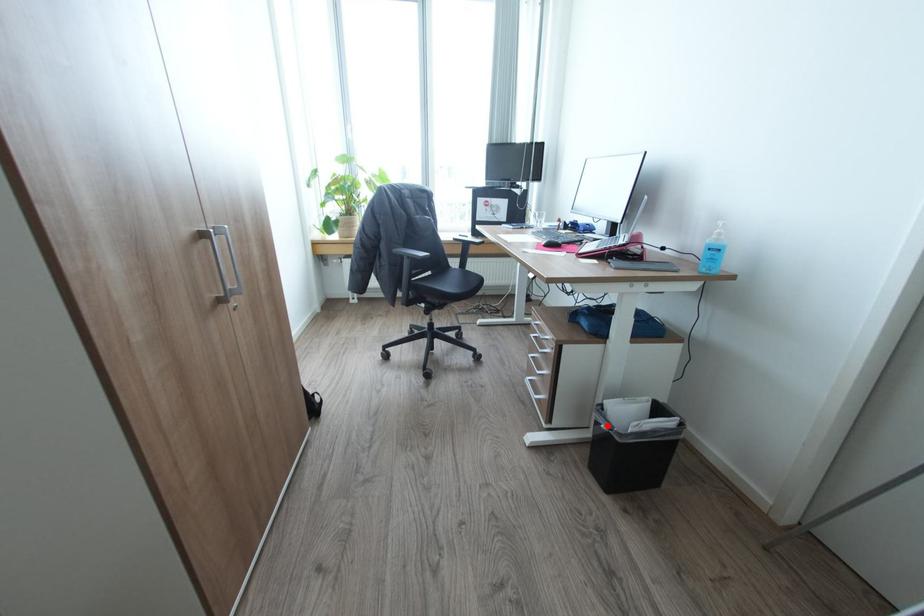
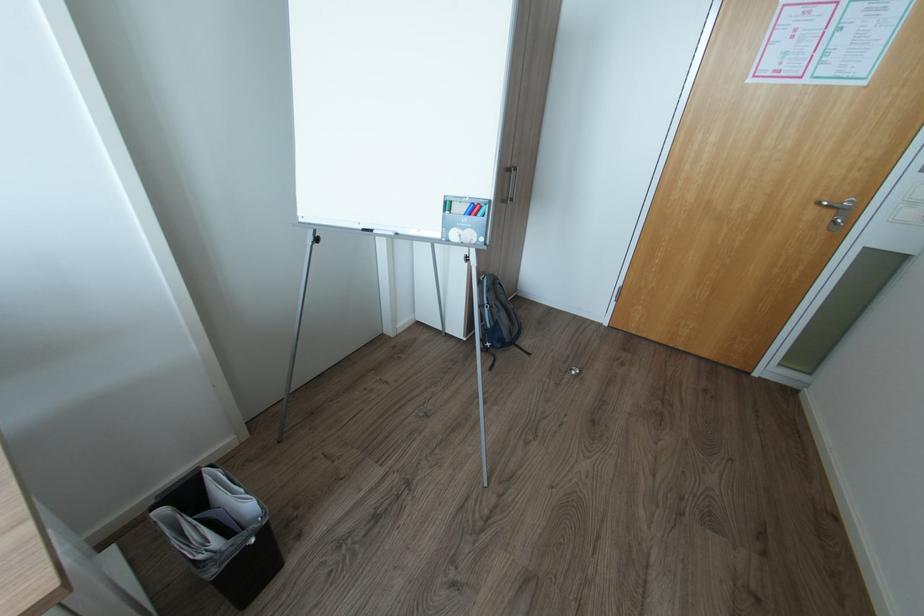
Question: I am providing you with two images of the same scene from different viewpoints. In image1, a red point is highlighted. Considering the same 3D point in image2, which of the following is correct?

Choices:
 (A) It is closer
 (B) It is farther

Answer: (B)